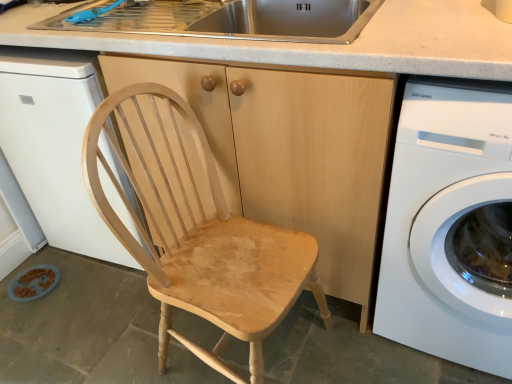
Question: From the image's perspective, is blue plastic faucet at upper left located above or below white glossy washing machine at right?

Choices:
 (A) above
 (B) below

Answer: (A)

Question: Is blue plastic faucet at upper left taller or shorter than white glossy washing machine at right?

Choices:
 (A) short
 (B) tall

Answer: (A)

Question: Considering the real-world distances, which object is closest to the blue plastic faucet at upper left?

Choices:
 (A) white glossy washing machine at right
 (B) light wood cabinet at center
 (C) white glossy dishwasher at left
 (D) stainless steel sink at upper center

Answer: (D)

Question: Which of these objects is positioned closest to the blue plastic faucet at upper left?

Choices:
 (A) white glossy dishwasher at left
 (B) light wood cabinet at center
 (C) stainless steel sink at upper center
 (D) white glossy washing machine at right

Answer: (C)